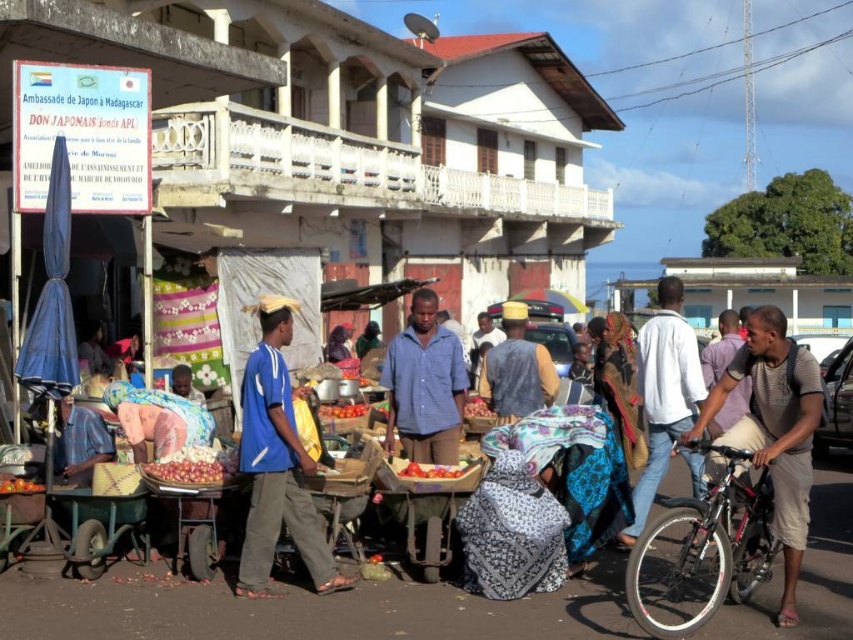
Looking at this image, can you confirm if yellow fabric hat at center is shorter than ripe red tomato at center?

In fact, yellow fabric hat at center may be taller than ripe red tomato at center.

Which is behind, point (503, 378) or point (15, 477)?

The point (503, 378) is behind.

What do you see at coordinates (515, 369) in the screenshot? I see `yellow fabric hat at center` at bounding box center [515, 369].

Identify the location of yellow fabric hat at center. (515, 369).

Consider the image. Can you confirm if blue fabric bag at center is thinner than white matte jacket at center?

Indeed, blue fabric bag at center has a lesser width compared to white matte jacket at center.

Does blue fabric bag at center come in front of white matte jacket at center?

No.

Which is in front, point (247, 528) or point (663, 378)?

Point (247, 528) is in front.

The width and height of the screenshot is (853, 640). Identify the location of blue fabric bag at center. (276, 464).

Is blue fabric bag at center to the left of ripe red tomato at center from the viewer's perspective?

No, blue fabric bag at center is not to the left of ripe red tomato at center.

Is blue fabric bag at center below ripe red tomato at center?

Actually, blue fabric bag at center is above ripe red tomato at center.

What do you see at coordinates (276, 464) in the screenshot?
I see `blue fabric bag at center` at bounding box center [276, 464].

The width and height of the screenshot is (853, 640). In order to click on blue fabric bag at center in this screenshot , I will do `click(276, 464)`.